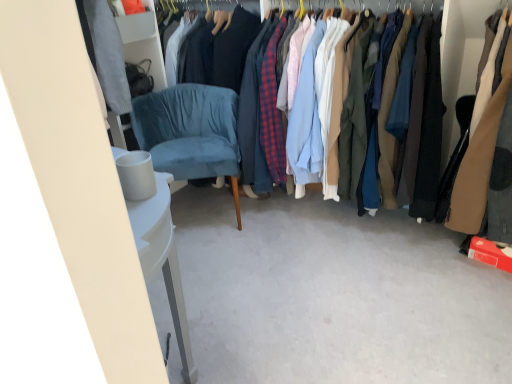
The width and height of the screenshot is (512, 384). In order to click on vacant area situated below matte cotton shirts at center, which is counted as the 2th clothing, starting from the right (from a real-world perspective) in this screenshot , I will do `click(332, 219)`.